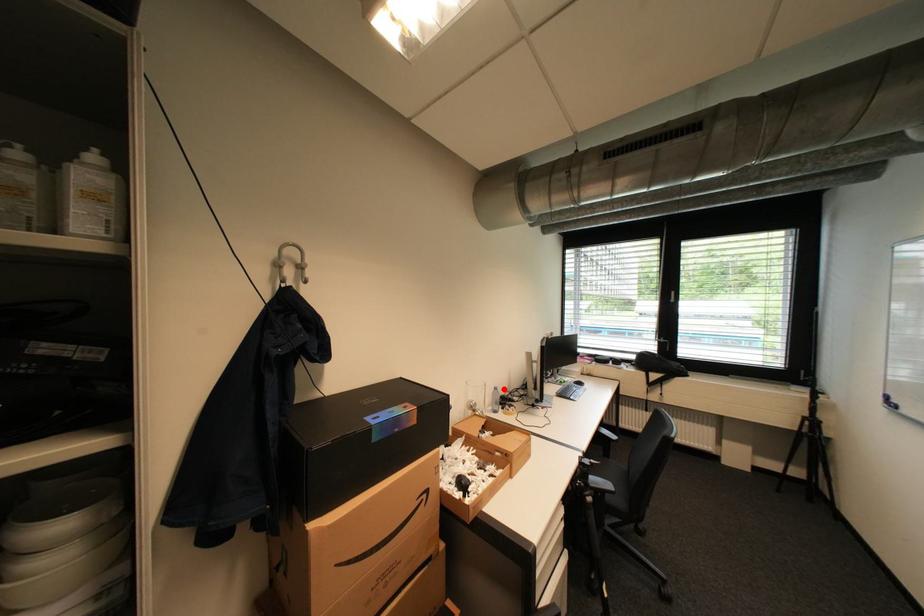
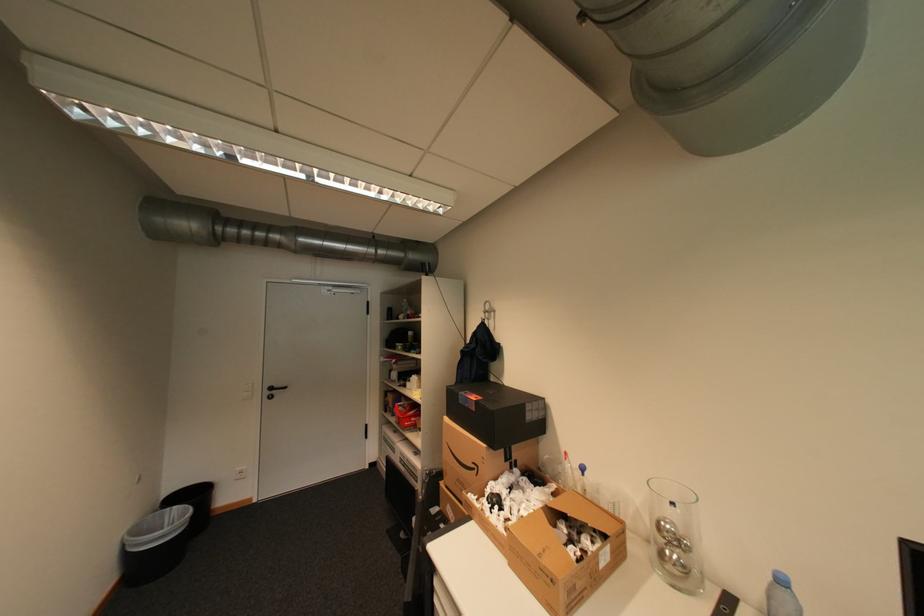
Question: I am providing you with two images of the same scene from different viewpoints. In image1, a red point is highlighted. Considering the same 3D point in image2, which of the following is correct?

Choices:
 (A) It is closer
 (B) It is farther

Answer: (B)